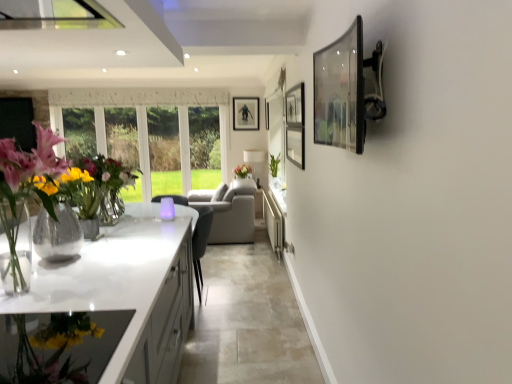
Question: Should I look upward or downward to see clear glass picture frame at upper right, placed as the third picture frame when sorted from back to front?

Choices:
 (A) up
 (B) down

Answer: (A)

Question: In which direction should I rotate to look at matte black picture frame at upper center, arranged as the second picture frame when viewed from the back?

Choices:
 (A) left
 (B) right

Answer: (B)

Question: Does matte black picture frame at upper center, the third picture frame in the bottom-to-top sequence, appear on the right side of pink matte flower at center?

Choices:
 (A) yes
 (B) no

Answer: (A)

Question: Does matte black picture frame at upper center, arranged as the third picture frame when viewed from the right, have a greater height compared to pink matte flower at center?

Choices:
 (A) no
 (B) yes

Answer: (B)

Question: Is matte black picture frame at upper center, which ranks as the first picture frame in left-to-right order, further to the viewer compared to pink matte flower at center?

Choices:
 (A) yes
 (B) no

Answer: (A)

Question: Can you confirm if matte black picture frame at upper center, positioned as the 1th picture frame in top-to-bottom order, is bigger than pink matte flower at center?

Choices:
 (A) yes
 (B) no

Answer: (B)

Question: Can you confirm if matte black picture frame at upper center, arranged as the third picture frame when viewed from the right, is wider than pink matte flower at center?

Choices:
 (A) yes
 (B) no

Answer: (B)

Question: Is matte black picture frame at upper center, the third picture frame when ordered from front to back, positioned with its back to pink matte flower at center?

Choices:
 (A) yes
 (B) no

Answer: (B)

Question: From the image's perspective, is white glossy countertop at lower left on top of matte black picture frame at upper center, which is the second picture frame in top-to-bottom order?

Choices:
 (A) no
 (B) yes

Answer: (A)

Question: Considering the relative positions of white glossy countertop at lower left and matte black picture frame at upper center, arranged as the 2th picture frame when viewed from the right, in the image provided, is white glossy countertop at lower left behind matte black picture frame at upper center, arranged as the 2th picture frame when viewed from the right,?

Choices:
 (A) no
 (B) yes

Answer: (A)

Question: From a real-world perspective, is white glossy countertop at lower left located beneath matte black picture frame at upper center, which is the second picture frame in top-to-bottom order?

Choices:
 (A) no
 (B) yes

Answer: (B)

Question: Is white glossy countertop at lower left not near matte black picture frame at upper center, the second picture frame viewed from the left?

Choices:
 (A) yes
 (B) no

Answer: (A)

Question: Considering the relative positions of white glossy countertop at lower left and matte black picture frame at upper center, arranged as the 2th picture frame when viewed from the right, in the image provided, is white glossy countertop at lower left to the left of matte black picture frame at upper center, arranged as the 2th picture frame when viewed from the right, from the viewer's perspective?

Choices:
 (A) no
 (B) yes

Answer: (B)

Question: Can you confirm if white glossy countertop at lower left is wider than matte black picture frame at upper center, which is the second picture frame in top-to-bottom order?

Choices:
 (A) yes
 (B) no

Answer: (A)

Question: Does matte black picture frame at upper center, acting as the 1th picture frame starting from the back, have a greater height compared to clear glass picture frame at upper right, arranged as the 1th picture frame when viewed from the front?

Choices:
 (A) yes
 (B) no

Answer: (A)